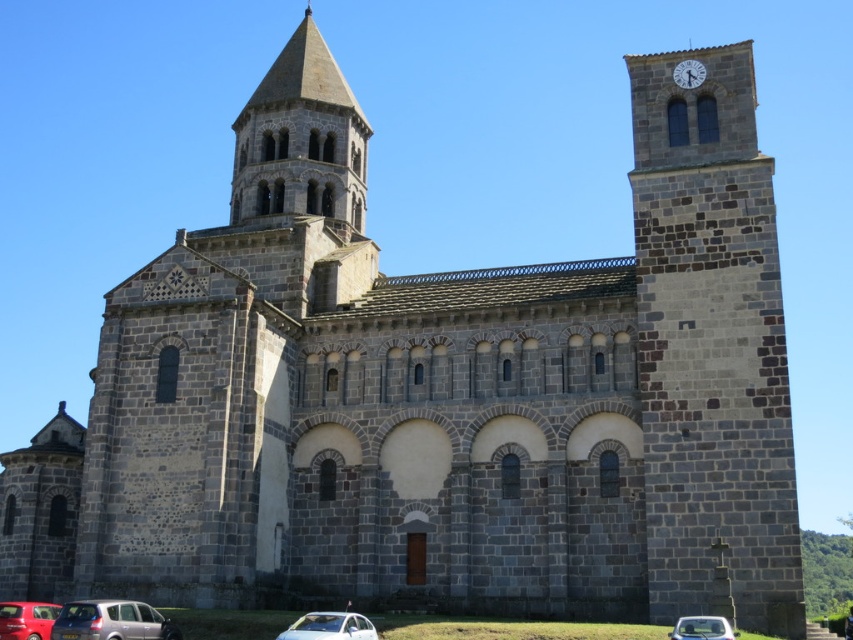
Question: Which point is closer to the camera?

Choices:
 (A) (6, 630)
 (B) (347, 612)
 (C) (703, 628)
 (D) (136, 621)

Answer: (C)

Question: Does dark gray stone clock tower at right have a greater width compared to silver metallic car at lower center?

Choices:
 (A) no
 (B) yes

Answer: (B)

Question: Which object is farther from the camera taking this photo?

Choices:
 (A) dark gray stone clock tower at right
 (B) silver metallic car at lower center
 (C) white matte car at lower right
 (D) white stone clock at upper right

Answer: (D)

Question: Which of the following is the farthest from the observer?

Choices:
 (A) dark gray stone clock tower at right
 (B) white stone clock at upper right
 (C) white matte car at lower right

Answer: (B)

Question: Does metallic gray hatchback at lower left have a lesser width compared to metallic red car at lower left?

Choices:
 (A) no
 (B) yes

Answer: (B)

Question: Can you confirm if metallic gray hatchback at lower left is positioned to the left of white matte car at lower right?

Choices:
 (A) no
 (B) yes

Answer: (B)